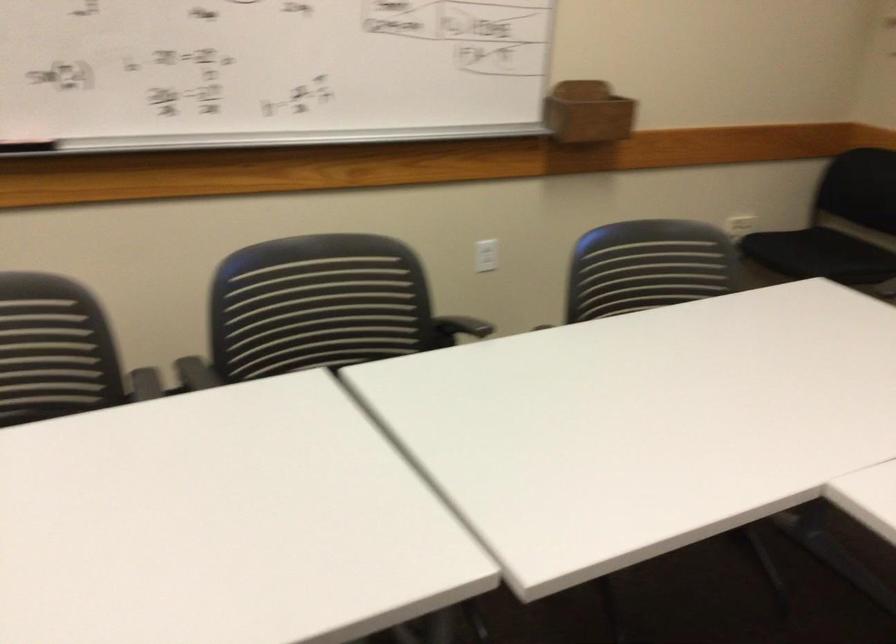
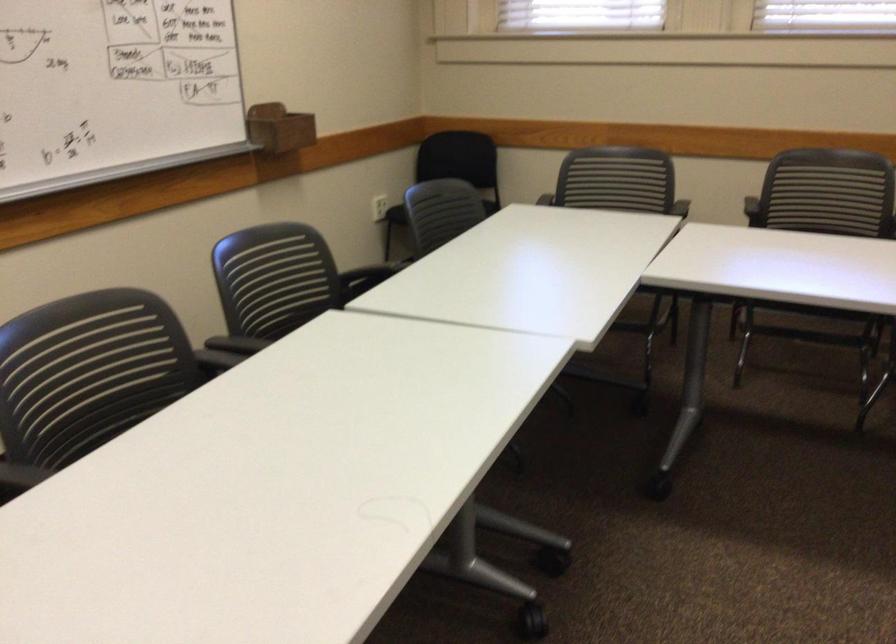
The point at (700, 265) is marked in the first image. Where is the corresponding point in the second image?

(441, 212)